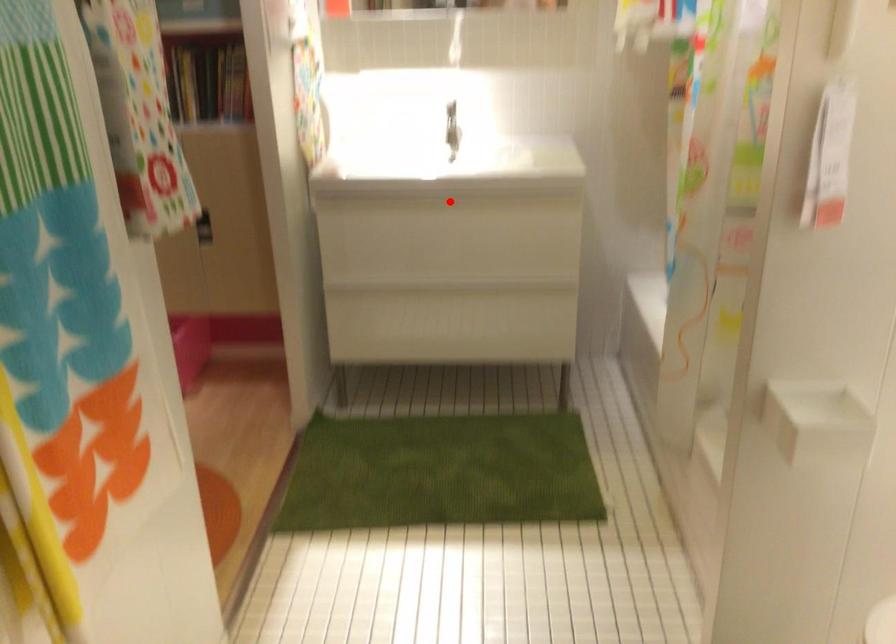
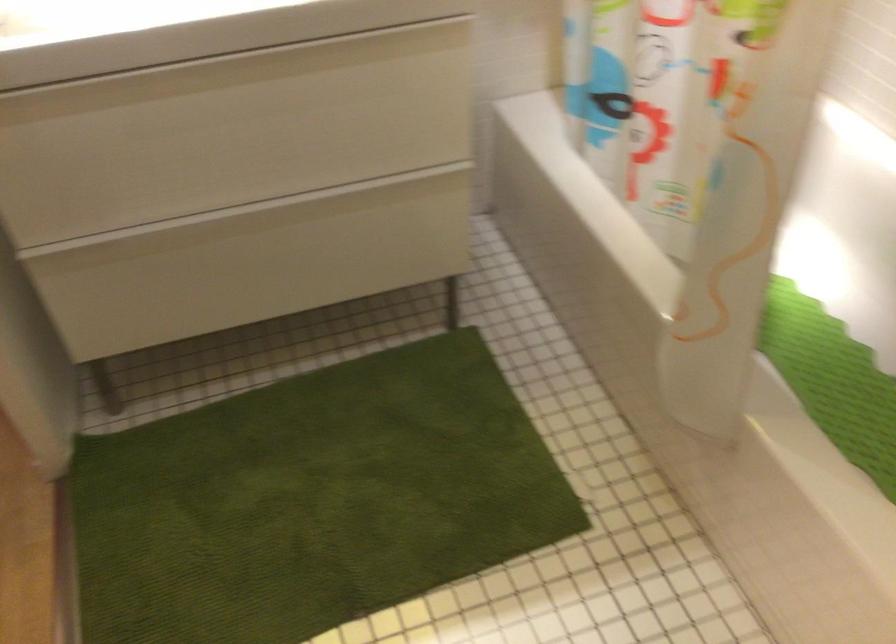
Question: I am providing you with two images of the same scene from different viewpoints. In image1, a red point is highlighted. Considering the same 3D point in image2, which of the following is correct?

Choices:
 (A) It is closer
 (B) It is farther

Answer: (A)